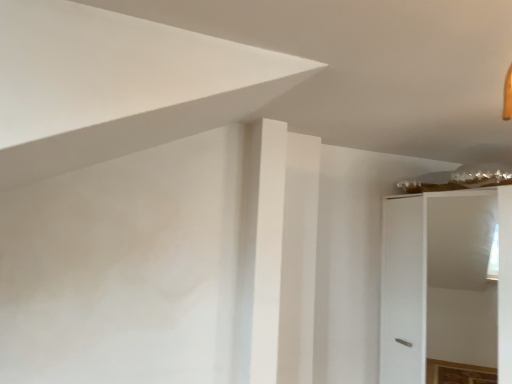
Question: Should I look upward or downward to see white matte cabinet at right?

Choices:
 (A) up
 (B) down

Answer: (B)